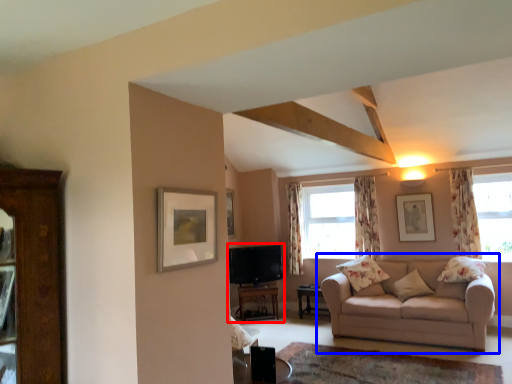
Question: Among these objects, which one is nearest to the camera, entertainment center (highlighted by a red box) or studio couch (highlighted by a blue box)?

Choices:
 (A) entertainment center
 (B) studio couch

Answer: (B)